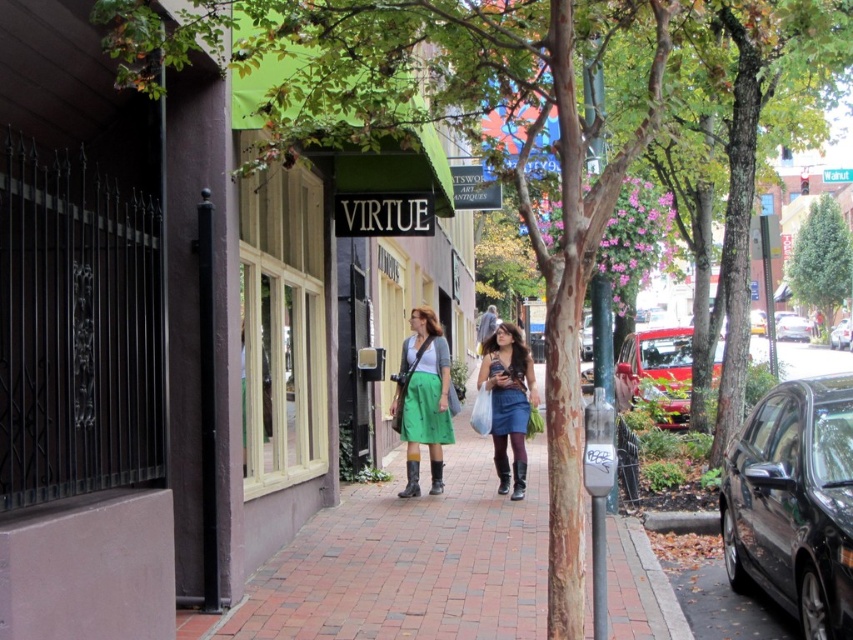
Question: In this image, where is green fabric awning at center located relative to black glossy sedan at right?

Choices:
 (A) left
 (B) right

Answer: (A)

Question: Can you confirm if brick pavement at center is bigger than black glossy sedan at right?

Choices:
 (A) no
 (B) yes

Answer: (A)

Question: Among these objects, which one is nearest to the camera?

Choices:
 (A) shiny red car at right
 (B) shiny black sedan at right
 (C) brick pavement at center
 (D) green matte skirt at center

Answer: (C)

Question: Which point is farther to the camera?

Choices:
 (A) (828, 268)
 (B) (503, 420)
 (C) (460, 492)
 (D) (676, 355)

Answer: (A)

Question: Which object appears farthest from the camera in this image?

Choices:
 (A) brick pavement at center
 (B) green fabric awning at center
 (C) white plastic bag at center
 (D) green matte skirt at center

Answer: (C)

Question: Does matte green skirt at center appear on the left side of shiny red car at right?

Choices:
 (A) no
 (B) yes

Answer: (B)